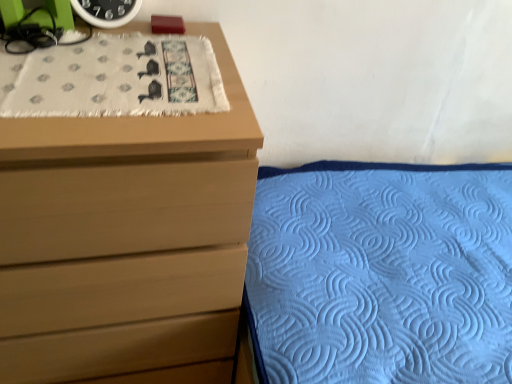
Question: Is green matte clock at upper left situated inside blue quilted fabric at lower right or outside?

Choices:
 (A) outside
 (B) inside

Answer: (A)

Question: In the image, is green matte clock at upper left on the left side or the right side of blue quilted fabric at lower right?

Choices:
 (A) left
 (B) right

Answer: (A)

Question: Which is nearer to the blue quilted fabric at lower right?

Choices:
 (A) green matte clock at upper left
 (B) matte wood chest of drawers at upper left
 (C) white textured cloth at upper left

Answer: (B)

Question: Considering the real-world distances, which object is closest to the white textured cloth at upper left?

Choices:
 (A) blue quilted fabric at lower right
 (B) matte wood chest of drawers at upper left
 (C) green matte clock at upper left

Answer: (C)